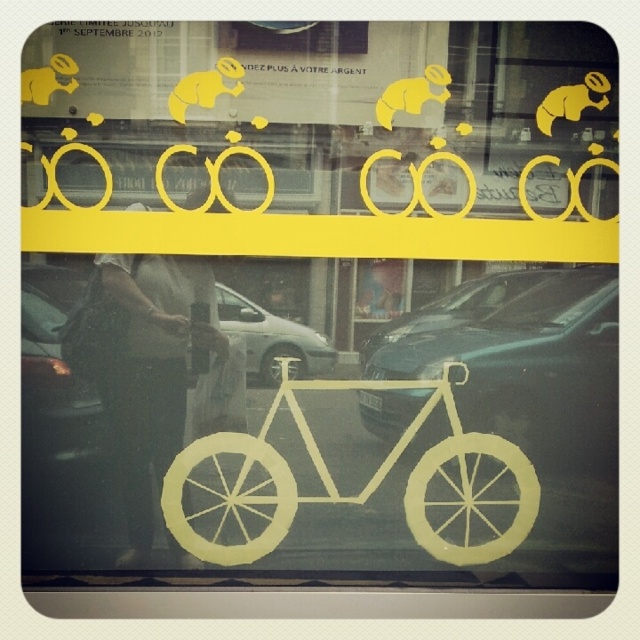
From the picture: Is matte black car at center closer to the viewer compared to yellow matte animal at upper center?

No, it is not.

Is point (225, 289) more distant than point (186, 108)?

Yes, point (225, 289) is farther from viewer.

Image resolution: width=640 pixels, height=640 pixels. I want to click on matte black car at center, so (273, 339).

Find the location of `matte black car at center`. matte black car at center is located at coordinates (273, 339).

Between metallic silver bicycle at center and yellow matte bicycle at center, which one is positioned lower?

yellow matte bicycle at center

Is point (563, 365) farther from camera compared to point (490, 454)?

No.

Based on the photo, who is more forward, [436,356] or [532,490]?

Positioned in front is point [532,490].

The image size is (640, 640). What are the coordinates of `metallic silver bicycle at center` in the screenshot? It's located at (538, 392).

Who is more distant from viewer, (561, 525) or (212, 100)?

The point (561, 525) is more distant.

Can you confirm if metallic silver bicycle at center is thinner than yellow matte animal at upper center?

In fact, metallic silver bicycle at center might be wider than yellow matte animal at upper center.

Is point (588, 451) closer to viewer compared to point (196, 100)?

No.

At what (x,y) coordinates should I click in order to perform the action: click on metallic silver bicycle at center. Please return your answer as a coordinate pair (x, y). Looking at the image, I should click on (538, 392).